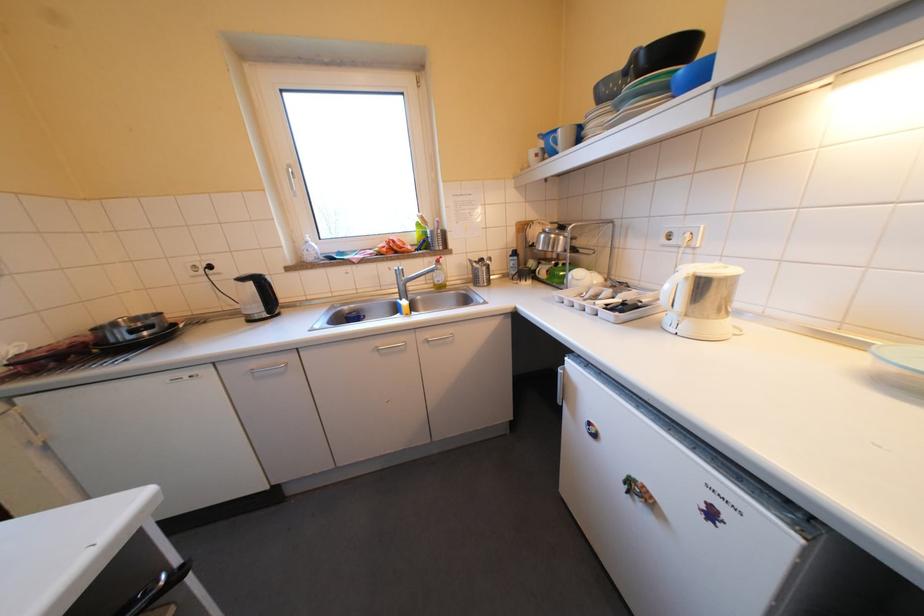
Where would you lift the silver pot handle? Please return your answer as a coordinate pair (x, y).

(266, 294)